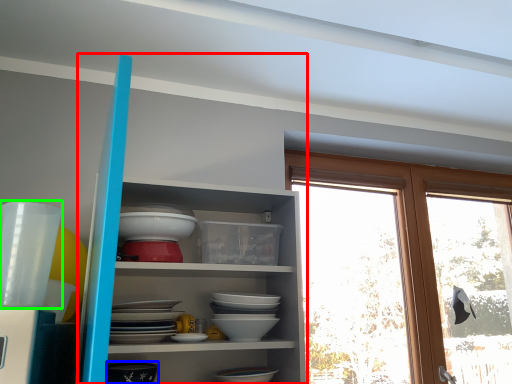
Question: Considering the real-world distances, which object is closest to shelf (highlighted by a red box)? tableware (highlighted by a blue box) or tableware (highlighted by a green box).

Choices:
 (A) tableware
 (B) tableware

Answer: (A)